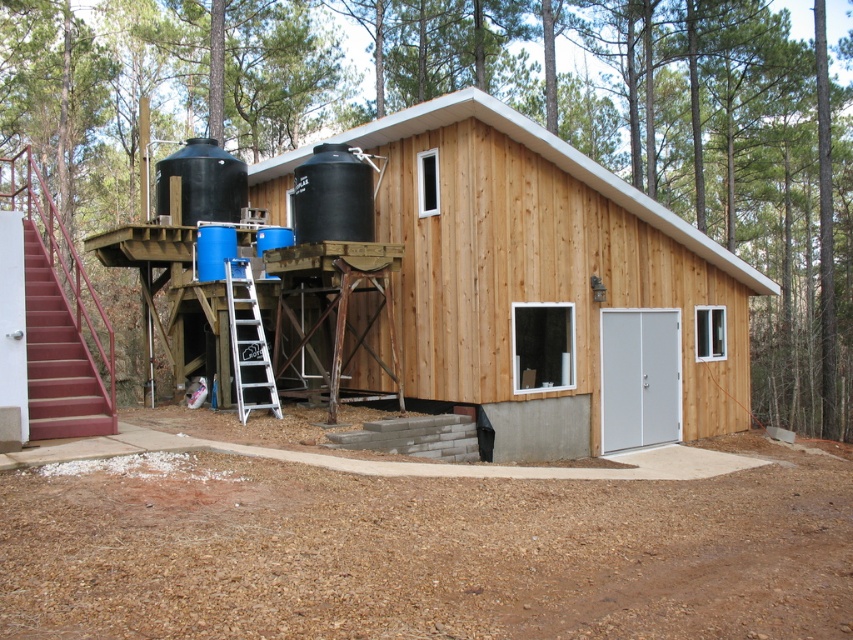
You are a contractor assessing the construction site. You need to determine if the natural wood cabin at center will block the view of the black matte water tank at upper left from the front entrance. Based on their heights, can you see the water tank from the entrance?

The natural wood cabin at center is not as tall as the black matte water tank at upper left, so the water tank should still be visible from the entrance since it is taller than the cabin.

You are a construction worker who needs to transport a 3.5 meter long beam from the natural wood cabin at center to the black matte water tank at upper left. Can you move the beam horizontally without tilting it? Explain your reasoning.

A: The distance between the natural wood cabin at center and the black matte water tank at upper left is 2.94 meters. Since the beam is 3.5 meters long, it is longer than the available space. Therefore, you cannot move the beam horizontally without tilting it.

Looking at this image, you are planning to move the white aluminum ladder at center into the natural wood cabin at center. Based on their sizes, will the ladder fit inside the cabin?

The natural wood cabin at center is narrower than the white aluminum ladder at center, so the ladder will not fit inside the cabin as it is wider than the cabin itself.